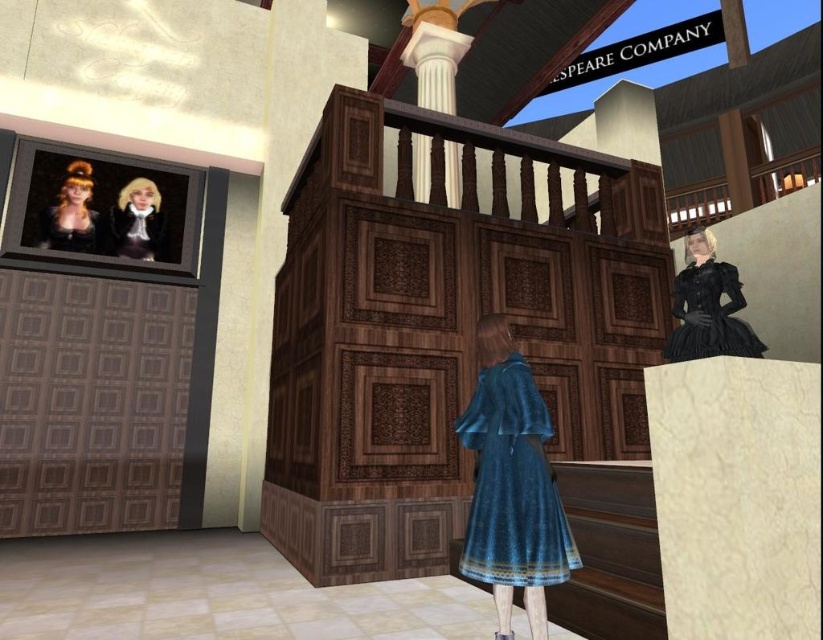
Question: Is white marble column at upper center positioned at the back of smooth black dress at upper left?

Choices:
 (A) yes
 (B) no

Answer: (A)

Question: Which object appears closest to the camera in this image?

Choices:
 (A) matte black dress at upper left
 (B) black satin dress at upper right

Answer: (B)

Question: Which object is positioned farthest from the white marble column at upper center?

Choices:
 (A) matte black hair at upper left
 (B) black satin dress at upper right
 (C) smooth black dress at upper left

Answer: (A)

Question: Which object is closer to the camera taking this photo?

Choices:
 (A) matte black hair at upper left
 (B) smooth black dress at upper left
 (C) black satin dress at upper right

Answer: (C)

Question: Can you confirm if matte black hair at upper left is positioned to the right of smooth black dress at upper left?

Choices:
 (A) no
 (B) yes

Answer: (A)

Question: Does velvet blue dress at center have a lesser width compared to matte black hair at upper left?

Choices:
 (A) no
 (B) yes

Answer: (B)